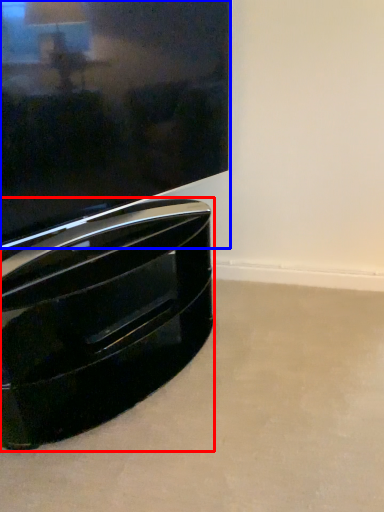
Question: Which point is closer to the camera, furniture (highlighted by a red box) or television (highlighted by a blue box)?

Choices:
 (A) furniture
 (B) television

Answer: (B)